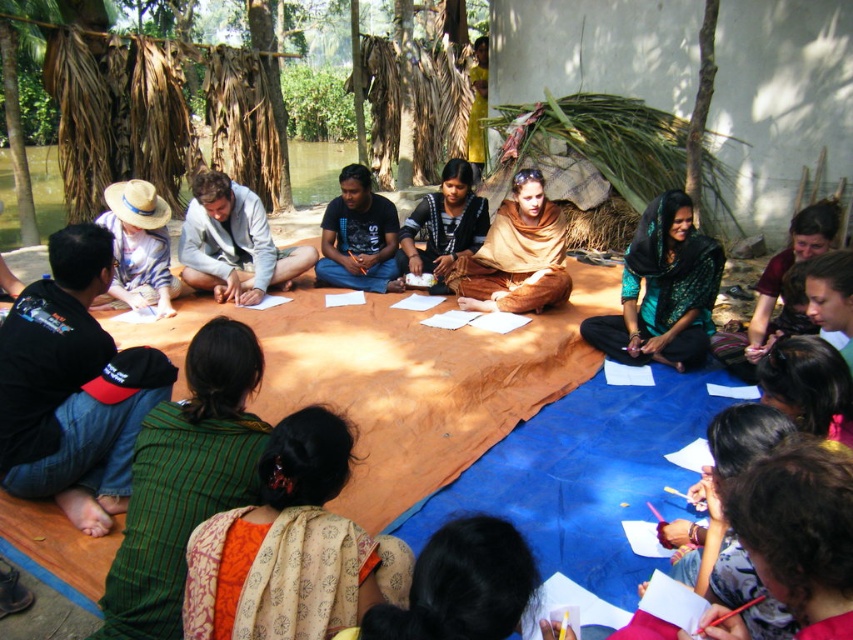
Question: Among these objects, which one is nearest to the camera?

Choices:
 (A) green plaid shirt at lower left
 (B) brown woven cloth at center

Answer: (A)

Question: Is green fabric shawl at center above black cotton shirt at center?

Choices:
 (A) yes
 (B) no

Answer: (B)

Question: Which of the following is the farthest from the observer?

Choices:
 (A) (381, 246)
 (B) (630, 307)
 (C) (447, 168)
 (D) (247, 500)

Answer: (A)

Question: Is the position of brown textured shawl at center less distant than that of brown woven cloth at center?

Choices:
 (A) no
 (B) yes

Answer: (B)

Question: Based on their relative distances, which object is nearer to the green fabric shawl at center?

Choices:
 (A) green plaid shirt at lower left
 (B) black cotton shirt at center
 (C) brown woven cloth at center
 (D) brown textured shawl at center

Answer: (D)

Question: Is green fabric shawl at center to the right of brown textured shawl at center from the viewer's perspective?

Choices:
 (A) yes
 (B) no

Answer: (A)